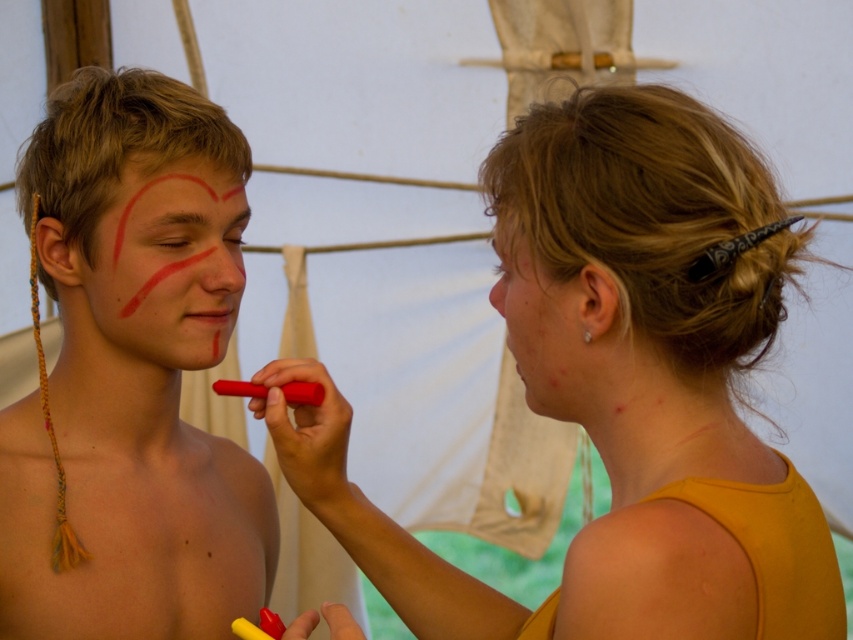
Looking at this image, you are a photographer positioned in front of the two individuals engaged in face painting. You notice two red paint containers at the center of the scene. Which one would appear larger in your camera viewfinder, the matte red paint at center or the smooth red paint at center?

The matte red paint at center appears larger in the camera viewfinder because it is closer to the viewer than the smooth red paint at center.